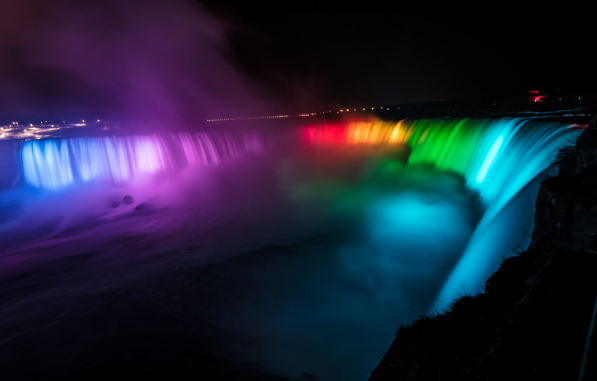
The image size is (597, 381). I want to click on green light, so click(x=452, y=162).